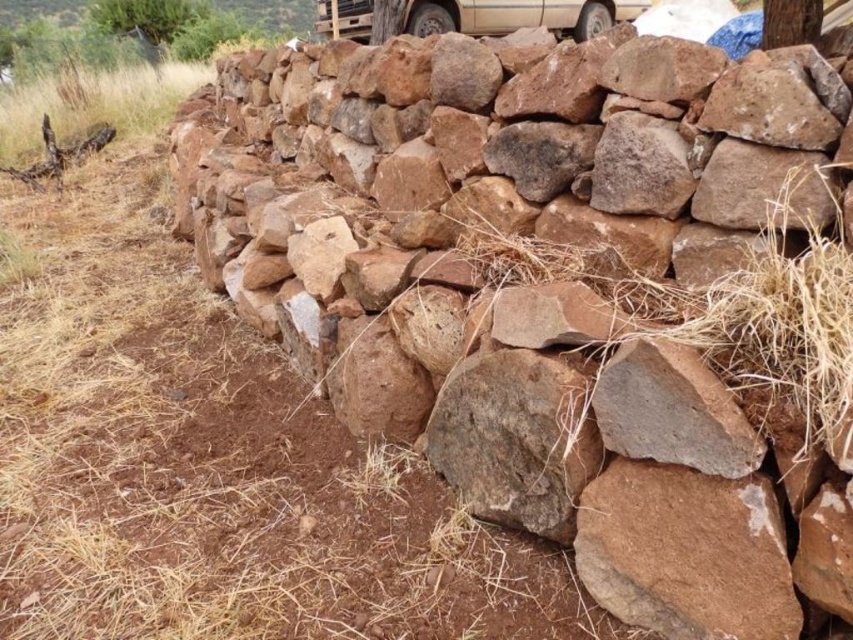
Looking at this image, you are a photographer trying to capture both the beige matte truck at upper center and the brown rough tree trunk at upper right in the same frame. Based on their heights, which object should you position closer to the camera to ensure both are fully visible?

The beige matte truck at upper center is much taller than the brown rough tree trunk at upper right. To ensure both are fully visible in the frame, you should position the beige matte truck at upper center closer to the camera since it is taller and requires more space vertically.

You are a photographer standing in front of the stone wall. You want to capture both the beige matte truck at upper center and the brown rough tree trunk at upper right in the same frame. Considering their sizes, which object will appear wider in the photo?

The beige matte truck at upper center will appear wider in the photo because its width is larger than that of the brown rough tree trunk at upper right.